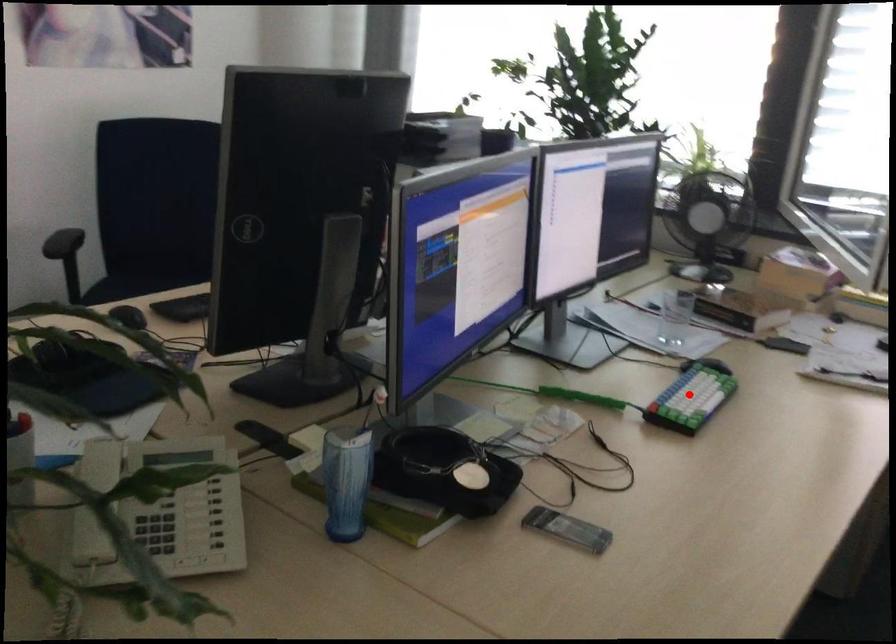
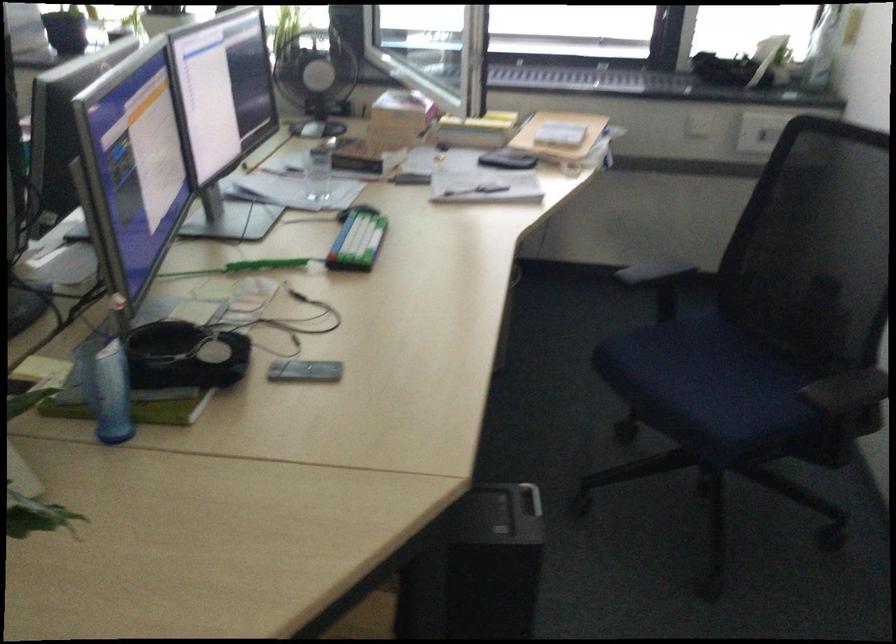
The point at the highlighted location is marked in the first image. Where is the corresponding point in the second image?

(357, 240)